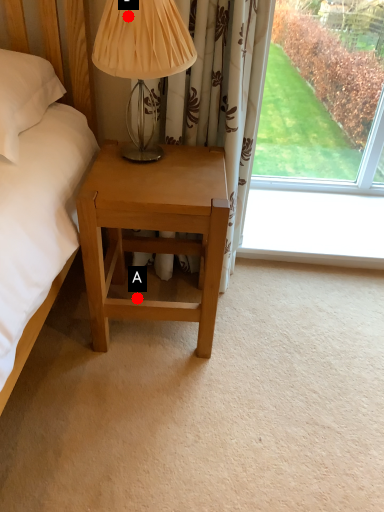
Question: Two points are circled on the image, labeled by A and B beside each circle. Which point is farther from the camera taking this photo?

Choices:
 (A) A is further
 (B) B is further

Answer: (A)